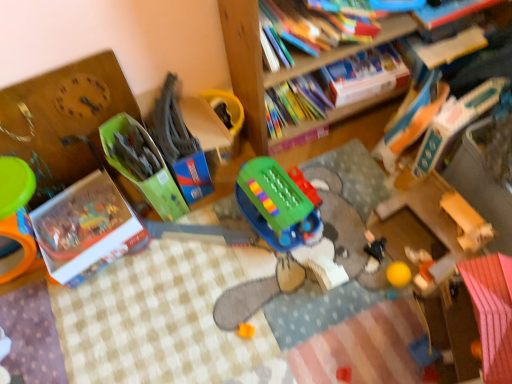
Question: In terms of size, does hardcover book at upper center, placed as the third book when sorted from left to right, appear bigger or smaller than green plastic toy at center, the 5th toy positioned from the right?

Choices:
 (A) small
 (B) big

Answer: (A)

Question: In the image, is hardcover book at upper center, which is the third book in right-to-left order, positioned in front of or behind green plastic toy at center, which ranks as the 2th toy in left-to-right order?

Choices:
 (A) front
 (B) behind

Answer: (B)

Question: Which object is positioned closest to the white cardboard book at lower left, the 1th book positioned from the left?

Choices:
 (A) green plastic toy at center, positioned as the third toy in right-to-left order
 (B) wooden bookcase at upper center
 (C) orange matte cube at center, the 4th toy viewed from the right
 (D) hardcover book at upper right, the fourth book positioned from the right
 (E) rubberized orange ball at lower right, which is the first toy in right-to-left order

Answer: (A)

Question: Considering the real-world distances, which object is closest to the green cardboard box at center, the sixth toy viewed from the right?

Choices:
 (A) white cardboard book at lower left, positioned as the fifth book in right-to-left order
 (B) rubberized orange ball at lower right, which is the first toy in right-to-left order
 (C) orange matte cube at center, the 4th toy viewed from the right
 (D) black plastic toy at center, positioned as the fifth toy in left-to-right order
 (E) wooden bookcase at upper center

Answer: (A)